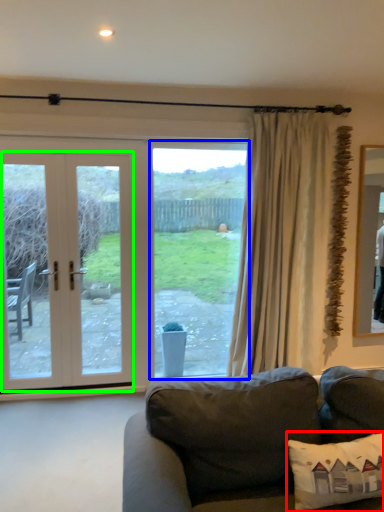
Question: Which object is the closest to the pillow (highlighted by a red box)? Choose among these: window (highlighted by a blue box) or door (highlighted by a green box).

Choices:
 (A) window
 (B) door

Answer: (A)